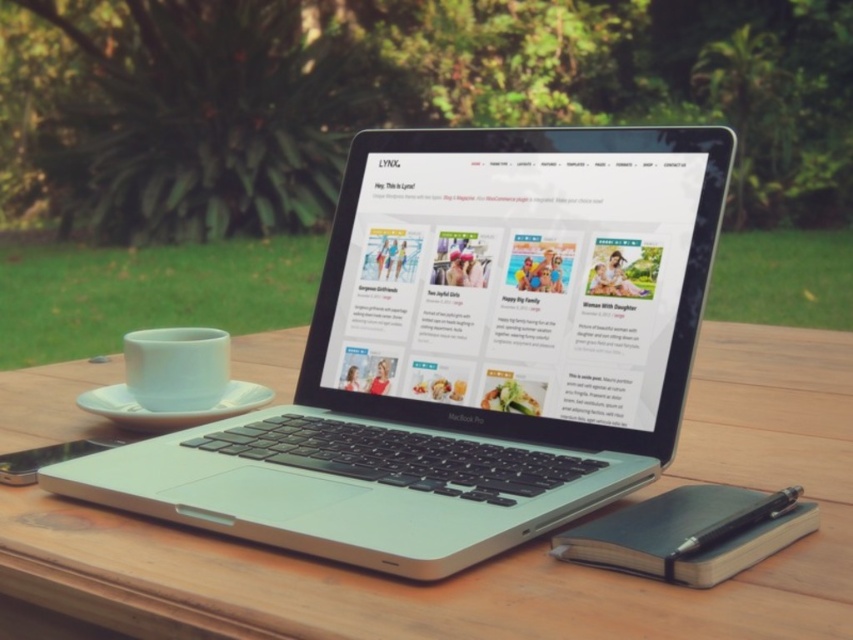
Question: Among these objects, which one is farthest from the camera?

Choices:
 (A) white matte saucer at lower left
 (B) sleek silver laptop at center
 (C) wooden table at center
 (D) satin silver macbook pro at center

Answer: (A)

Question: Which of these objects is positioned closest to the satin silver macbook pro at center?

Choices:
 (A) sleek silver laptop at center
 (B) wooden table at center

Answer: (A)

Question: Can you confirm if wooden table at center is thinner than satin silver macbook pro at center?

Choices:
 (A) no
 (B) yes

Answer: (A)

Question: Is wooden table at center below white matte saucer at lower left?

Choices:
 (A) yes
 (B) no

Answer: (A)

Question: Does sleek silver laptop at center appear on the right side of satin silver macbook pro at center?

Choices:
 (A) no
 (B) yes

Answer: (A)

Question: Which of the following is the closest to the observer?

Choices:
 (A) (19, 515)
 (B) (474, 420)

Answer: (A)